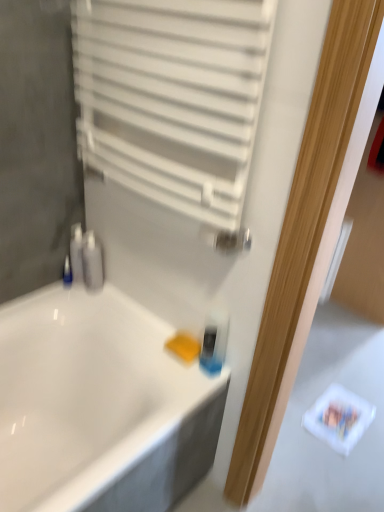
Identify the location of vacant space to the left of translucent plastic mouthwash at center. The image size is (384, 512). (163, 370).